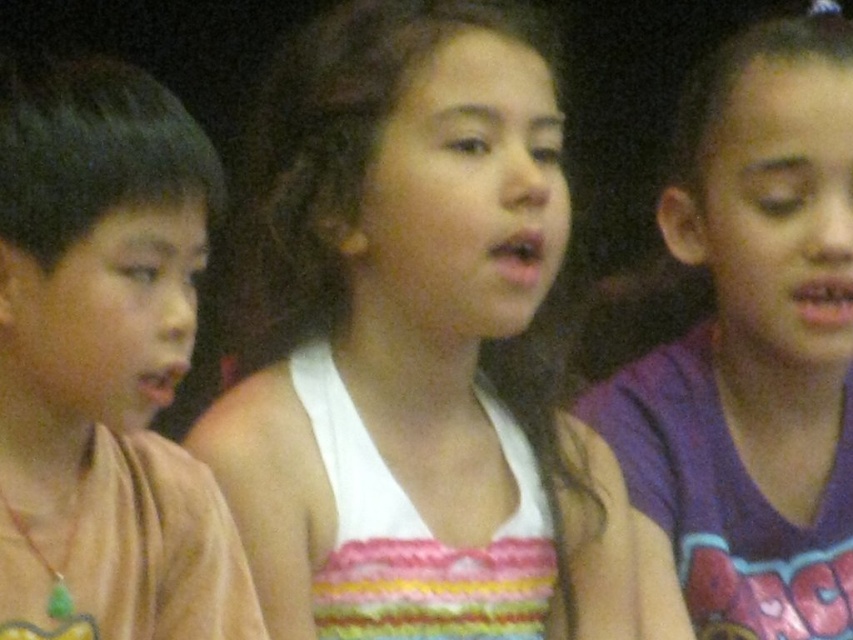
You are observing three children sitting together in a group. You notice two specific points in the scene labeled as point 1 at coordinate (643, 531) and point 2 at coordinate (177, 248). Which point is closer to you?

Point 1 at coordinate (643, 531) is closer to you than point 2 at coordinate (177, 248).

You are a photographer taking a group photo of the children. You notice the purple cotton shirt at right and the brown cotton shirt at left. Which child should you ask to move closer to avoid being cut off in the frame?

The purple cotton shirt at right has a greater width than the brown cotton shirt at left, so you should ask the child in the purple cotton shirt at right to move closer to avoid being cut off in the frame.